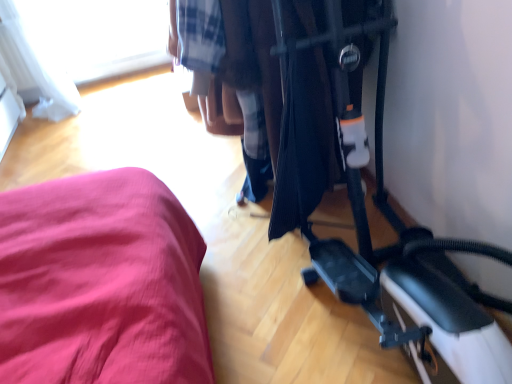
Locate an element on the screen. black plastic baby carriage at center is located at coordinates (398, 232).

This screenshot has width=512, height=384. What do you see at coordinates (398, 232) in the screenshot?
I see `black plastic baby carriage at center` at bounding box center [398, 232].

The image size is (512, 384). What do you see at coordinates (102, 34) in the screenshot? I see `transparent glass window at upper left` at bounding box center [102, 34].

In order to face transparent glass window at upper left, should I rotate leftwards or rightwards?

It's best to rotate left around 18.975 degrees.

Image resolution: width=512 pixels, height=384 pixels. Find the location of `transparent glass window at upper left`. transparent glass window at upper left is located at coordinates (102, 34).

Identify the location of black plastic baby carriage at center. Image resolution: width=512 pixels, height=384 pixels. (398, 232).

Is transparent glass window at upper left at the left side of black plastic baby carriage at center?

Yes.

Considering the relative positions of transparent glass window at upper left and black plastic baby carriage at center in the image provided, is transparent glass window at upper left behind black plastic baby carriage at center?

Yes, it is behind black plastic baby carriage at center.

Between point (157, 44) and point (463, 330), which one is positioned in front?

Point (463, 330)

From the image's perspective, which is above, transparent glass window at upper left or black plastic baby carriage at center?

transparent glass window at upper left.

From a real-world perspective, is transparent glass window at upper left positioned above or below black plastic baby carriage at center?

transparent glass window at upper left is situated lower than black plastic baby carriage at center in the real world.

Is transparent glass window at upper left thinner than black plastic baby carriage at center?

Yes, transparent glass window at upper left is thinner than black plastic baby carriage at center.

Considering the relative sizes of transparent glass window at upper left and black plastic baby carriage at center in the image provided, is transparent glass window at upper left shorter than black plastic baby carriage at center?

Yes, transparent glass window at upper left is shorter than black plastic baby carriage at center.

Which of these two, transparent glass window at upper left or black plastic baby carriage at center, is bigger?

Bigger between the two is black plastic baby carriage at center.

Is transparent glass window at upper left located outside black plastic baby carriage at center?

Absolutely, transparent glass window at upper left is external to black plastic baby carriage at center.

Would you consider transparent glass window at upper left to be distant from black plastic baby carriage at center?

transparent glass window at upper left is positioned a significant distance from black plastic baby carriage at center.

Is transparent glass window at upper left oriented away from black plastic baby carriage at center?

No, black plastic baby carriage at center is not at the back of transparent glass window at upper left.

Can you tell me how much transparent glass window at upper left and black plastic baby carriage at center differ in facing direction?

The angle between the facing direction of transparent glass window at upper left and the facing direction of black plastic baby carriage at center is 179 degrees.

The image size is (512, 384). In order to click on window behind the black plastic baby carriage at center in this screenshot , I will do `click(102, 34)`.

Is black plastic baby carriage at center at the left side of transparent glass window at upper left?

In fact, black plastic baby carriage at center is to the right of transparent glass window at upper left.

Is black plastic baby carriage at center behind transparent glass window at upper left?

No, black plastic baby carriage at center is in front of transparent glass window at upper left.

Which is in front, point (335, 86) or point (128, 5)?

The point (335, 86) is in front.

Looking at this image, from the image's perspective, would you say black plastic baby carriage at center is shown under transparent glass window at upper left?

Indeed, from the image's perspective, black plastic baby carriage at center is shown beneath transparent glass window at upper left.

From a real-world perspective, is black plastic baby carriage at center over transparent glass window at upper left?

Indeed, from a real-world perspective, black plastic baby carriage at center stands above transparent glass window at upper left.

Does black plastic baby carriage at center have a greater width compared to transparent glass window at upper left?

Indeed, black plastic baby carriage at center has a greater width compared to transparent glass window at upper left.

From their relative heights in the image, would you say black plastic baby carriage at center is taller or shorter than transparent glass window at upper left?

Clearly, black plastic baby carriage at center is taller compared to transparent glass window at upper left.

Is black plastic baby carriage at center smaller than transparent glass window at upper left?

Incorrect, black plastic baby carriage at center is not smaller in size than transparent glass window at upper left.

Is black plastic baby carriage at center spatially inside transparent glass window at upper left, or outside of it?

black plastic baby carriage at center cannot be found inside transparent glass window at upper left.

Would you say black plastic baby carriage at center is a long distance from transparent glass window at upper left?

black plastic baby carriage at center is far away from transparent glass window at upper left.

Is black plastic baby carriage at center positioned with its back to transparent glass window at upper left?

No, transparent glass window at upper left is not at the back of black plastic baby carriage at center.

How far apart are black plastic baby carriage at center and transparent glass window at upper left?

A distance of 2.80 meters exists between black plastic baby carriage at center and transparent glass window at upper left.

The width and height of the screenshot is (512, 384). Find the location of `baby carriage below the transparent glass window at upper left (from the image's perspective)`. baby carriage below the transparent glass window at upper left (from the image's perspective) is located at coordinates (398, 232).

At what (x,y) coordinates should I click in order to perform the action: click on baby carriage in front of the transparent glass window at upper left. Please return your answer as a coordinate pair (x, y). The image size is (512, 384). Looking at the image, I should click on (398, 232).

In the image, there is a transparent glass window at upper left. At what (x,y) coordinates should I click in order to perform the action: click on baby carriage below it (from the image's perspective). Please return your answer as a coordinate pair (x, y). Looking at the image, I should click on (398, 232).